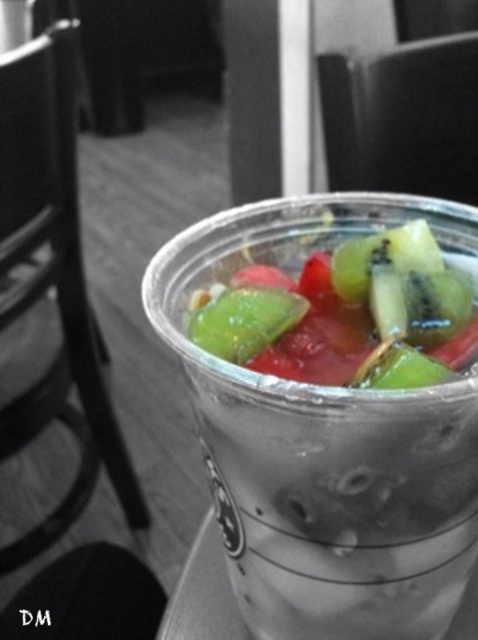
Who is positioned more to the left, translucent plastic fruit salad at center or green matte kiwi at center?

green matte kiwi at center

Can you confirm if translucent plastic fruit salad at center is thinner than green matte kiwi at center?

No, translucent plastic fruit salad at center is not thinner than green matte kiwi at center.

You are a GUI agent. You are given a task and a screenshot of the screen. Output one action in this format:
    pyautogui.click(x=<x>, y=<y>)
    Task: Click on the translucent plastic fruit salad at center
    The height and width of the screenshot is (640, 478).
    Given the screenshot: What is the action you would take?
    pyautogui.click(x=343, y=314)

From the picture: Can you confirm if transparent plastic cup at center is positioned to the left of green matte kiwi at center?

No, transparent plastic cup at center is not to the left of green matte kiwi at center.

Based on the photo, can you confirm if transparent plastic cup at center is positioned to the right of green matte kiwi at center?

Yes, transparent plastic cup at center is to the right of green matte kiwi at center.

Which is in front, point (217, 401) or point (278, 314)?

Point (217, 401) is in front.

This screenshot has height=640, width=478. In order to click on transparent plastic cup at center in this screenshot , I will do click(327, 442).

Can you confirm if transparent plastic cup at center is taller than translucent plastic fruit salad at center?

Indeed, transparent plastic cup at center has a greater height compared to translucent plastic fruit salad at center.

Is transparent plastic cup at center wider than translucent plastic fruit salad at center?

Correct, the width of transparent plastic cup at center exceeds that of translucent plastic fruit salad at center.

Is point (433, 433) positioned before point (442, 349)?

Yes, point (433, 433) is in front of point (442, 349).

The image size is (478, 640). Identify the location of transparent plastic cup at center. (327, 442).